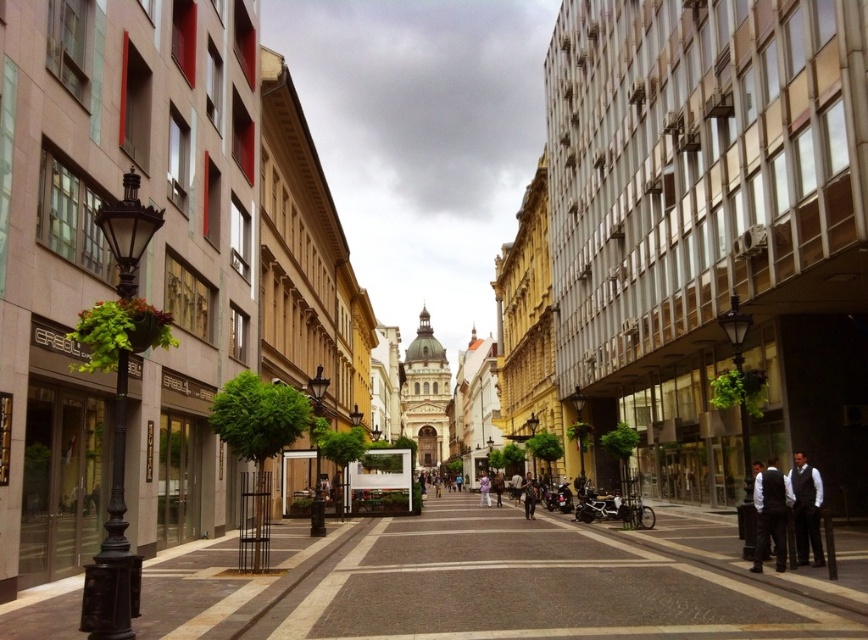
You are a delivery person standing at the dark gray suit at right and need to reach the white fabric person at center. The delivery robot you are using has a maximum range of 60 meters. Can you safely deliver the package using your robot?

The dark gray suit at right and white fabric person at center are 58.09 meters apart from each other. Since the robot has a 60 meter range, you can safely deliver the package.

You are a photographer standing at the end of the street near the cathedral. You notice two dark gray suits in the scene. Which dark gray suit is closer to the cathedral? Please choose between the dark gray suit at lower right and the dark gray suit at right.

The dark gray suit at lower right is closer to the cathedral because it is positioned to the left of the dark gray suit at right, and since you are standing near the cathedral at the end of the street, the one further left along the street would be nearer to your position.

You are a tourist standing at the entrance of the street and want to take a photo of the cathedral at the end. However, there are two people blocking your view. The dark gray suit at lower right and the white fabric person at center. Which person is closer to you and blocking your view more?

The dark gray suit at lower right is positioned over white fabric person at center, meaning it is closer to you and blocking your view more.